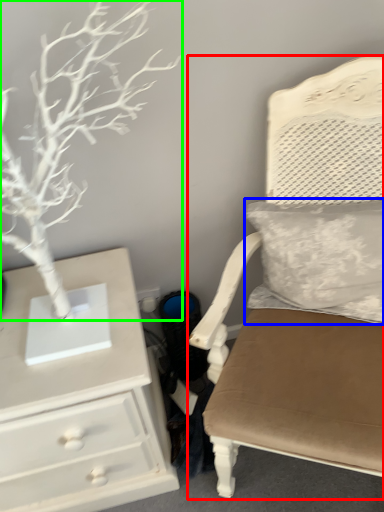
Question: Which object is the closest to the chair (highlighted by a red box)? Choose among these: pillow (highlighted by a blue box) or tree (highlighted by a green box).

Choices:
 (A) pillow
 (B) tree

Answer: (A)